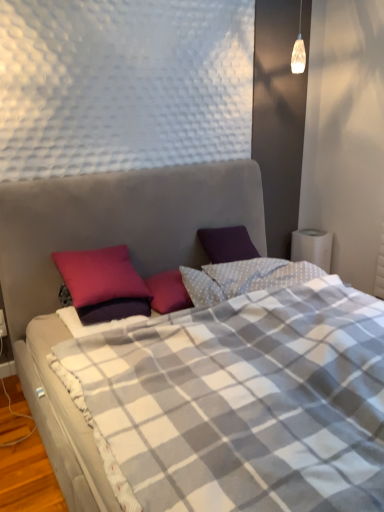
The height and width of the screenshot is (512, 384). I want to click on purple matte pillow at upper left, so click(100, 276).

Locate an element on the screen. white plastic electric outlet at lower left is located at coordinates (2, 325).

This screenshot has width=384, height=512. What do you see at coordinates (104, 245) in the screenshot? I see `plaid fabric bed at center` at bounding box center [104, 245].

I want to click on purple matte pillow at upper left, so click(100, 276).

Is plaid fabric bed at center in contact with purple matte pillow at upper left?

No, plaid fabric bed at center is not beside purple matte pillow at upper left.

Does plaid fabric bed at center have a greater height compared to purple matte pillow at upper left?

Indeed, plaid fabric bed at center has a greater height compared to purple matte pillow at upper left.

Who is more distant, plaid fabric bed at center or purple matte pillow at upper left?

Positioned behind is purple matte pillow at upper left.

Could you tell me if plaid fabric bed at center is turned towards purple matte pillow at upper left?

No, plaid fabric bed at center is not oriented towards purple matte pillow at upper left.

The image size is (384, 512). What are the coordinates of `bed that is on the right side of white plastic electric outlet at lower left` in the screenshot? It's located at (104, 245).

Is plaid fabric bed at center far away from white plastic electric outlet at lower left?

They are positioned close to each other.

Is plaid fabric bed at center facing towards white plastic electric outlet at lower left?

No, plaid fabric bed at center is not facing towards white plastic electric outlet at lower left.

Is plaid fabric bed at center to the left or to the right of white plastic electric outlet at lower left in the image?

plaid fabric bed at center is positioned on white plastic electric outlet at lower left's right side.

From a real-world perspective, who is located higher, white plastic electric outlet at lower left or purple matte pillow at upper left?

purple matte pillow at upper left is physically above.

Considering the relative sizes of white plastic electric outlet at lower left and purple matte pillow at upper left in the image provided, is white plastic electric outlet at lower left thinner than purple matte pillow at upper left?

Correct, the width of white plastic electric outlet at lower left is less than that of purple matte pillow at upper left.

What's the angular difference between white plastic electric outlet at lower left and purple matte pillow at upper left's facing directions?

white plastic electric outlet at lower left and purple matte pillow at upper left are facing 2.43 degrees away from each other.

Is white plastic electric outlet at lower left oriented away from purple matte pillow at upper left?

No, white plastic electric outlet at lower left's orientation is not away from purple matte pillow at upper left.

Between purple matte pillow at upper left and plaid fabric bed at center, which one has smaller width?

Thinner between the two is purple matte pillow at upper left.

Does purple matte pillow at upper left appear on the right side of plaid fabric bed at center?

No, purple matte pillow at upper left is not to the right of plaid fabric bed at center.

Does purple matte pillow at upper left come behind plaid fabric bed at center?

Yes, purple matte pillow at upper left is further from the camera.

Is purple matte pillow at upper left looking in the opposite direction of plaid fabric bed at center?

That's right, purple matte pillow at upper left is facing away from plaid fabric bed at center.

From a real-world perspective, who is located higher, purple matte pillow at upper left or white plastic electric outlet at lower left?

In real-world perspective, purple matte pillow at upper left is above.

Is purple matte pillow at upper left placed right next to white plastic electric outlet at lower left?

No, purple matte pillow at upper left is not next to white plastic electric outlet at lower left.

Is purple matte pillow at upper left spatially inside white plastic electric outlet at lower left, or outside of it?

purple matte pillow at upper left is spatially situated outside white plastic electric outlet at lower left.

Considering the positions of points (121, 254) and (3, 323), is point (121, 254) farther from camera compared to point (3, 323)?

Yes, it is.

From the image's perspective, is white plastic electric outlet at lower left positioned above or below plaid fabric bed at center?

white plastic electric outlet at lower left is below plaid fabric bed at center.

Between white plastic electric outlet at lower left and plaid fabric bed at center, which one appears on the right side from the viewer's perspective?

plaid fabric bed at center is more to the right.

Is plaid fabric bed at center at the back of white plastic electric outlet at lower left?

No, white plastic electric outlet at lower left's orientation is not away from plaid fabric bed at center.

Which is closer to the camera, (3, 319) or (13, 317)?

Point (3, 319).

Locate an element on the screen. The image size is (384, 512). bed in front of the purple matte pillow at upper left is located at coordinates (104, 245).

Find the location of a particular element. This screenshot has height=512, width=384. bed lying on the right of white plastic electric outlet at lower left is located at coordinates (104, 245).

When comparing their distances from purple matte pillow at upper left, does white plastic electric outlet at lower left or plaid fabric bed at center seem further?

Among the two, white plastic electric outlet at lower left is located further to purple matte pillow at upper left.

When comparing their distances from plaid fabric bed at center, does purple matte pillow at upper left or white plastic electric outlet at lower left seem closer?

purple matte pillow at upper left is closer to plaid fabric bed at center.

Considering their positions, is plaid fabric bed at center positioned further to purple matte pillow at upper left than white plastic electric outlet at lower left?

white plastic electric outlet at lower left is positioned further to the anchor purple matte pillow at upper left.

Which object lies nearer to the anchor point white plastic electric outlet at lower left, purple matte pillow at upper left or plaid fabric bed at center?

purple matte pillow at upper left is closer to white plastic electric outlet at lower left.

Looking at the image, which one is located further to plaid fabric bed at center, white plastic electric outlet at lower left or purple matte pillow at upper left?

Among the two, white plastic electric outlet at lower left is located further to plaid fabric bed at center.

Looking at this image, which object lies further to the anchor point white plastic electric outlet at lower left, plaid fabric bed at center or purple matte pillow at upper left?

plaid fabric bed at center.

The width and height of the screenshot is (384, 512). Find the location of `pillow located between plaid fabric bed at center and white plastic electric outlet at lower left in the depth direction`. pillow located between plaid fabric bed at center and white plastic electric outlet at lower left in the depth direction is located at coordinates tap(100, 276).